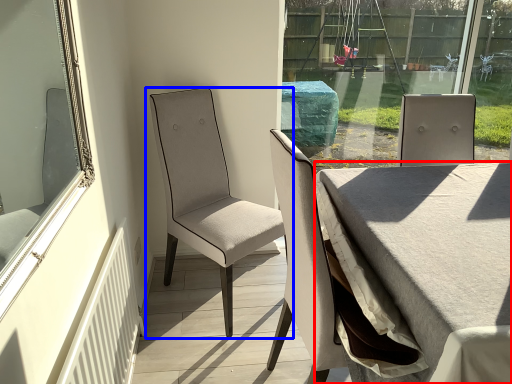
Question: Among these objects, which one is nearest to the camera, table (highlighted by a red box) or chair (highlighted by a blue box)?

Choices:
 (A) table
 (B) chair

Answer: (A)